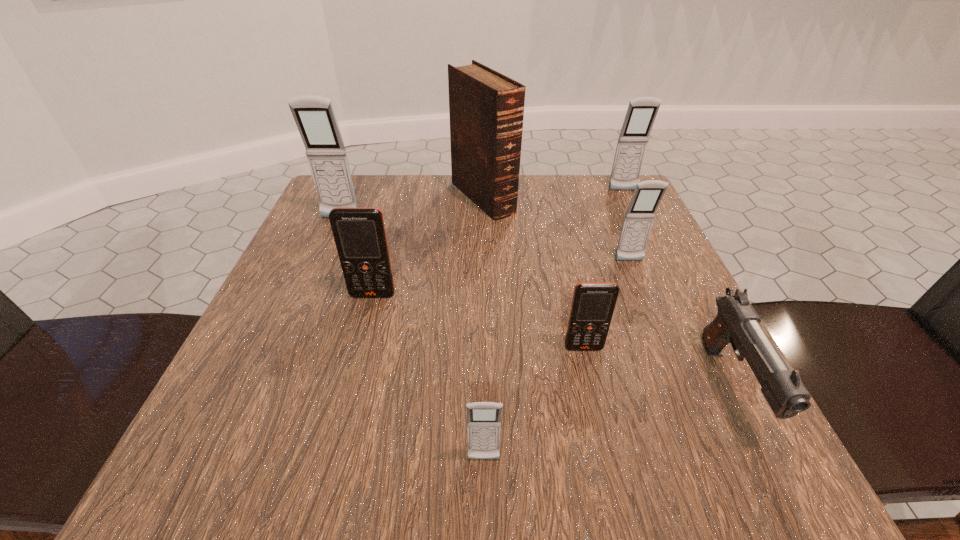
In the image, there is a desktop. Where is `vacant space at the far left corner`? vacant space at the far left corner is located at coordinates (354, 177).

Locate an element on the screen. The width and height of the screenshot is (960, 540). vacant space at the near left corner of the desktop is located at coordinates (204, 439).

Where is `vacant space at the far right corner`? The image size is (960, 540). vacant space at the far right corner is located at coordinates (614, 214).

Locate an element on the screen. This screenshot has width=960, height=540. blank region between the right orange cellular telephone and the third cellular telephone from left to right is located at coordinates (534, 404).

Find the location of `vacant point located between the leftmost cellular telephone and the Bible`. vacant point located between the leftmost cellular telephone and the Bible is located at coordinates pos(412,208).

This screenshot has width=960, height=540. I want to click on unoccupied area between the second biggest gray cellular telephone and the Bible, so click(553, 194).

At what (x,y) coordinates should I click in order to perform the action: click on vacant region between the gray gun and the smallest gray cellular telephone. Please return your answer as a coordinate pair (x, y). The image size is (960, 540). Looking at the image, I should click on (608, 423).

The width and height of the screenshot is (960, 540). What are the coordinates of `free space between the farthest cellular telephone and the third gray cellular telephone from right to left` in the screenshot? It's located at (554, 325).

Image resolution: width=960 pixels, height=540 pixels. Identify the location of blank region between the second farthest cellular telephone and the gun. (536, 302).

Identify the location of free space between the leftmost cellular telephone and the Bible. This screenshot has width=960, height=540. (412, 208).